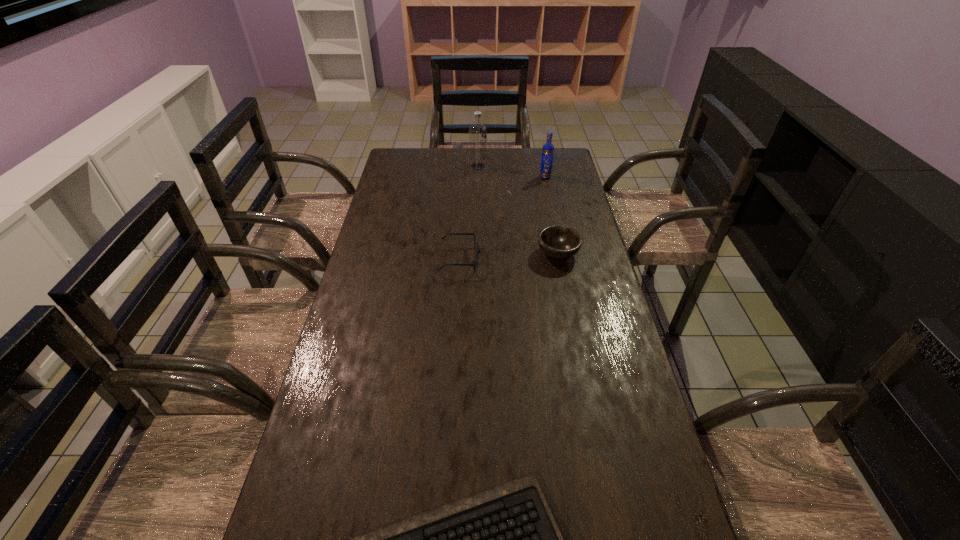
In order to click on vodka situated at the right edge in this screenshot , I will do `click(548, 149)`.

I want to click on bowl that is at the right edge, so click(x=557, y=241).

Find the location of a particular element. This screenshot has height=540, width=960. object situated at the far right corner is located at coordinates (548, 149).

At what (x,y) coordinates should I click in order to perform the action: click on free space at the far edge. Please return your answer as a coordinate pair (x, y). Looking at the image, I should click on (526, 173).

You are a GUI agent. You are given a task and a screenshot of the screen. Output one action in this format:
    pyautogui.click(x=<x>, y=<y>)
    Task: Click on the free region at the left edge of the desktop
    
    Given the screenshot: What is the action you would take?
    pyautogui.click(x=327, y=534)

Find the location of a particular element. vacant space at the right edge is located at coordinates (587, 253).

Locate an element on the screen. The height and width of the screenshot is (540, 960). vacant area that lies between the second shortest object and the farther vodka is located at coordinates (468, 213).

Image resolution: width=960 pixels, height=540 pixels. In order to click on free space that is in between the bowl and the tallest object in this screenshot , I will do `click(517, 210)`.

You are a GUI agent. You are given a task and a screenshot of the screen. Output one action in this format:
    pyautogui.click(x=<x>, y=<y>)
    Task: Click on the free space that is in between the left vodka and the spectacles
    The height and width of the screenshot is (540, 960).
    Given the screenshot: What is the action you would take?
    (x=468, y=213)

Image resolution: width=960 pixels, height=540 pixels. Identify the location of object that is the fourth closest to the computer keyboard. (477, 132).